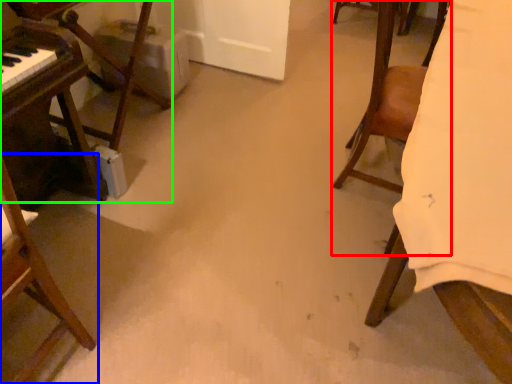
Question: Based on their relative distances, which object is nearer to chair (highlighted by a red box)? Choose from chair (highlighted by a blue box) and furniture (highlighted by a green box).

Choices:
 (A) chair
 (B) furniture

Answer: (B)